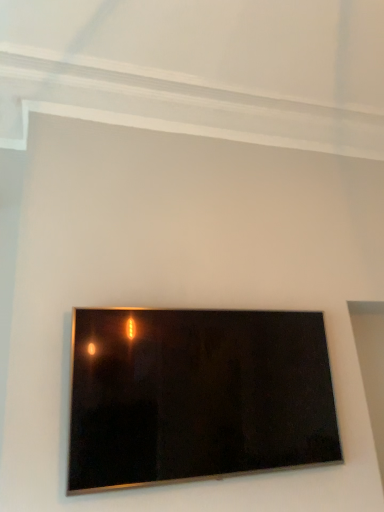
Measure the distance between matte black tv at lower center and camera.

The depth of matte black tv at lower center is 1.65 meters.

This screenshot has width=384, height=512. Describe the element at coordinates (197, 395) in the screenshot. I see `matte black tv at lower center` at that location.

Measure the distance between point (261,332) and camera.

6.67 feet.

You are a GUI agent. You are given a task and a screenshot of the screen. Output one action in this format:
    pyautogui.click(x=<x>, y=<y>)
    Task: Click on the matte black tv at lower center
    
    Given the screenshot: What is the action you would take?
    pyautogui.click(x=197, y=395)

Locate an element on the screen. Image resolution: width=384 pixels, height=512 pixels. matte black tv at lower center is located at coordinates (197, 395).